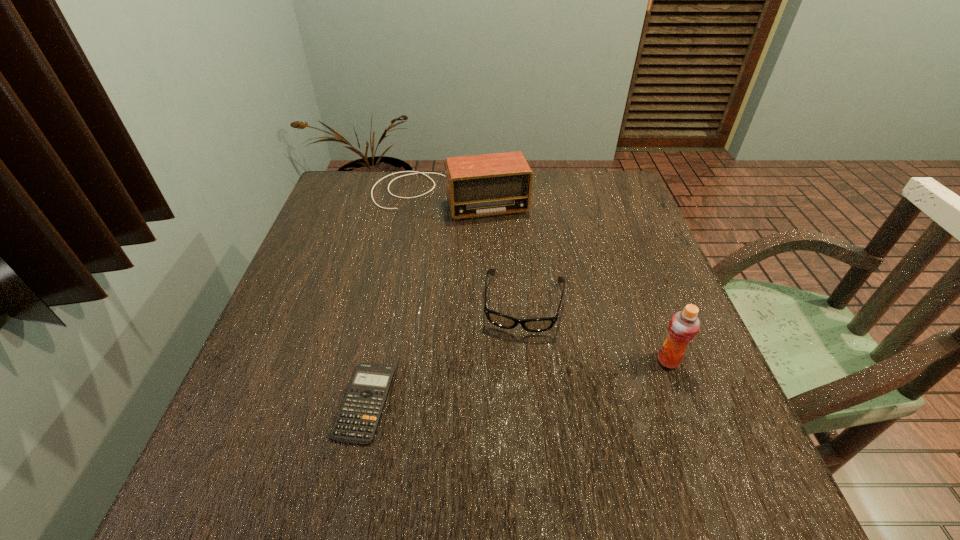
You are a GUI agent. You are given a task and a screenshot of the screen. Output one action in this format:
    pyautogui.click(x=<x>, y=<y>)
    Task: Click on the vacant space at the right edge
    This screenshot has width=960, height=540.
    Given the screenshot: What is the action you would take?
    pyautogui.click(x=640, y=226)

Locate an element on the screen. vacant position at the far left corner of the desktop is located at coordinates (363, 211).

The image size is (960, 540). In the image, there is a desktop. Find the location of `vacant space at the far right corner`. vacant space at the far right corner is located at coordinates (572, 171).

Identify the location of vacant space in between the spectacles and the farthest object. The image size is (960, 540). (487, 249).

Where is `free space between the calculator and the orange juice`? free space between the calculator and the orange juice is located at coordinates (516, 381).

Identify the location of unoccupied area between the shortest object and the farthest object. (407, 299).

Locate an element on the screen. free point between the farthest object and the third nearest object is located at coordinates (487, 249).

In order to click on vacant space that is in between the orange juice and the shortest object in this screenshot , I will do `click(516, 381)`.

This screenshot has width=960, height=540. Identify the location of vacant space that's between the calculator and the orange juice. click(x=516, y=381).

Where is `vacant space that is in between the shortest object and the farthest object`? vacant space that is in between the shortest object and the farthest object is located at coordinates (407, 299).